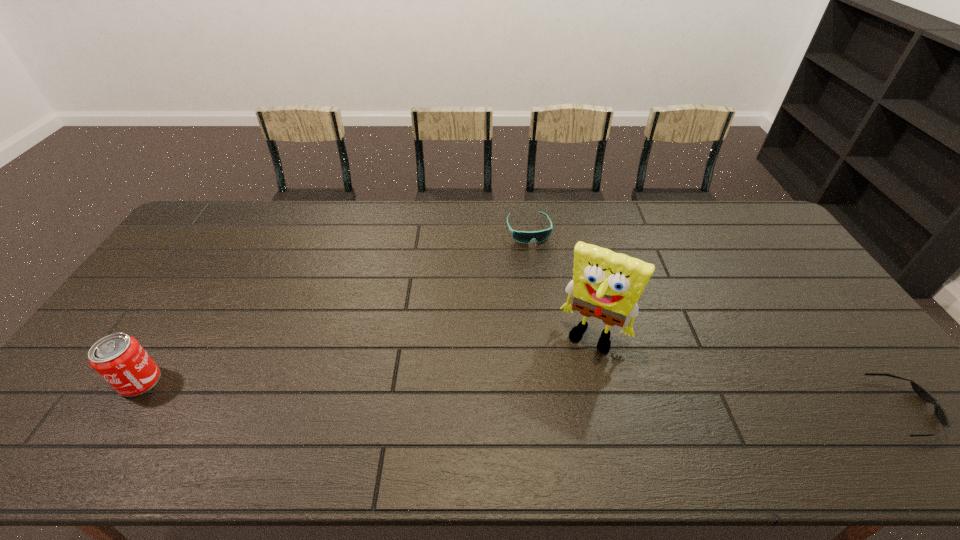
The height and width of the screenshot is (540, 960). I want to click on vacant space on the desktop that is between the second tallest object and the rightmost object and is positioned on the front-facing side of the second shortest object, so click(581, 396).

At what (x,y) coordinates should I click in order to perform the action: click on free space on the desktop that is between the can and the right sunglasses and is positioned on the face of the tallest object. Please return your answer as a coordinate pair (x, y). The image size is (960, 540). Looking at the image, I should click on (565, 396).